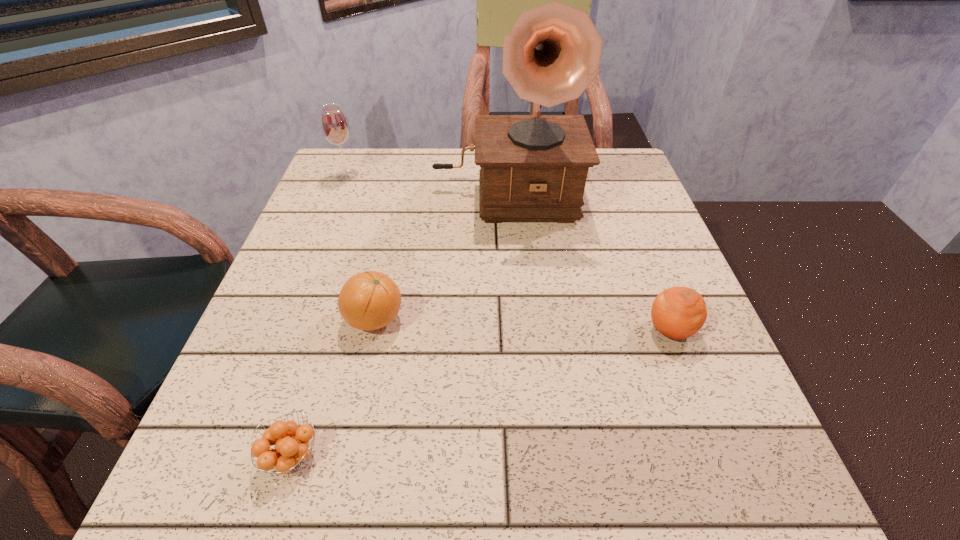
Locate an element on the screen. The height and width of the screenshot is (540, 960). object that stands as the fourth closest to the shortest object is located at coordinates (334, 124).

Image resolution: width=960 pixels, height=540 pixels. Find the location of `object that is the second closest to the tallest object`. object that is the second closest to the tallest object is located at coordinates (370, 300).

Identify which orange fruit is located as the nearest to the nearest object. Please provide its 2D coordinates. Your answer should be formatted as a tuple, i.e. [(x, y)], where the tuple contains the x and y coordinates of a point satisfying the conditions above.

[(370, 300)]

Identify the location of orange fruit that stands as the second closest to the shortest orange fruit. (678, 312).

Where is `free space in the image that satisfies the following two spatial constraints: 1. on the horn of the rightmost orange fruit; 2. on the left side of the fourth object from left to right`? The height and width of the screenshot is (540, 960). free space in the image that satisfies the following two spatial constraints: 1. on the horn of the rightmost orange fruit; 2. on the left side of the fourth object from left to right is located at coordinates (516, 330).